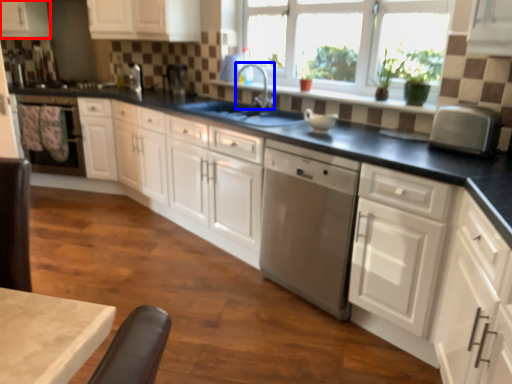
Question: Which point is further to the camera, cabinetry (highlighted by a red box) or faucet (highlighted by a blue box)?

Choices:
 (A) cabinetry
 (B) faucet

Answer: (A)